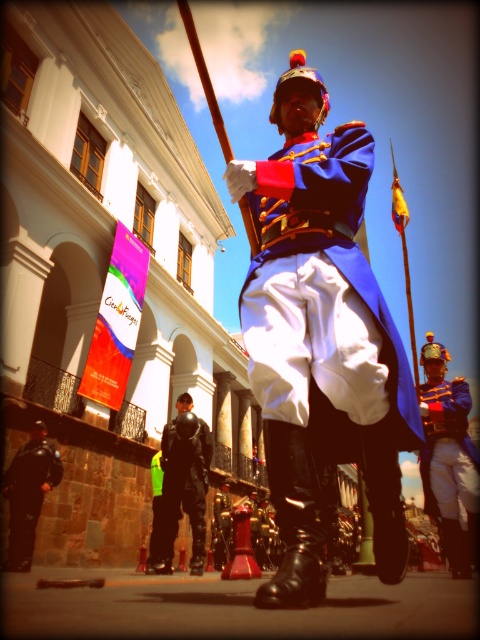
Question: Can you confirm if black leather jacket at lower center is positioned above black leather pants at lower left?

Choices:
 (A) no
 (B) yes

Answer: (A)

Question: Which of the following is the farthest from the observer?

Choices:
 (A) black leather pants at lower left
 (B) black leather jacket at lower center

Answer: (B)

Question: Which is nearer to the matte blue uniform at center?

Choices:
 (A) black leather jacket at lower center
 (B) blue glossy uniform at center
 (C) black leather pants at lower left

Answer: (B)

Question: Is blue glossy uniform at center positioned behind black leather pants at lower left?

Choices:
 (A) no
 (B) yes

Answer: (A)

Question: Is blue glossy uniform at center smaller than matte blue uniform at center?

Choices:
 (A) no
 (B) yes

Answer: (B)

Question: Among these points, which one is farthest from the camera?

Choices:
 (A) (x=425, y=392)
 (B) (x=14, y=552)

Answer: (A)